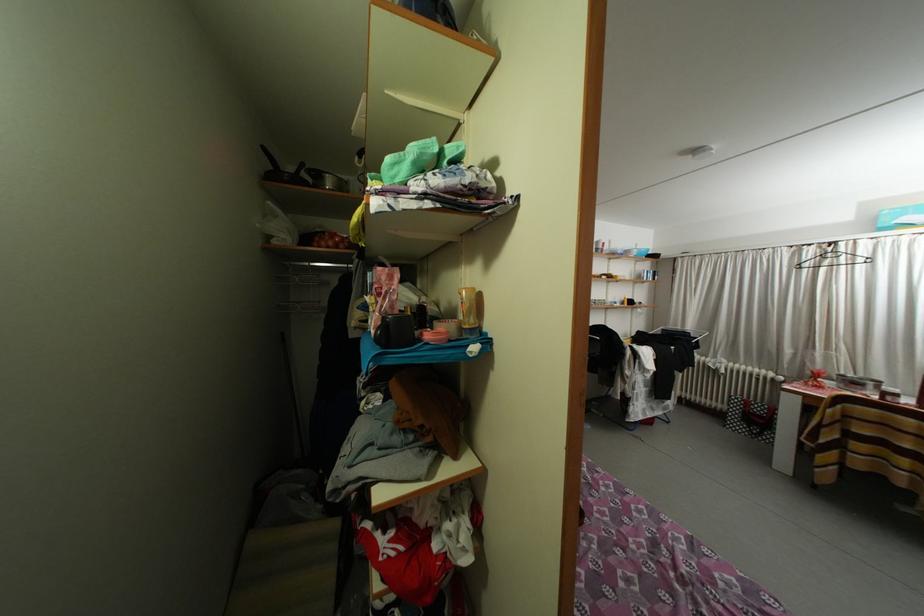
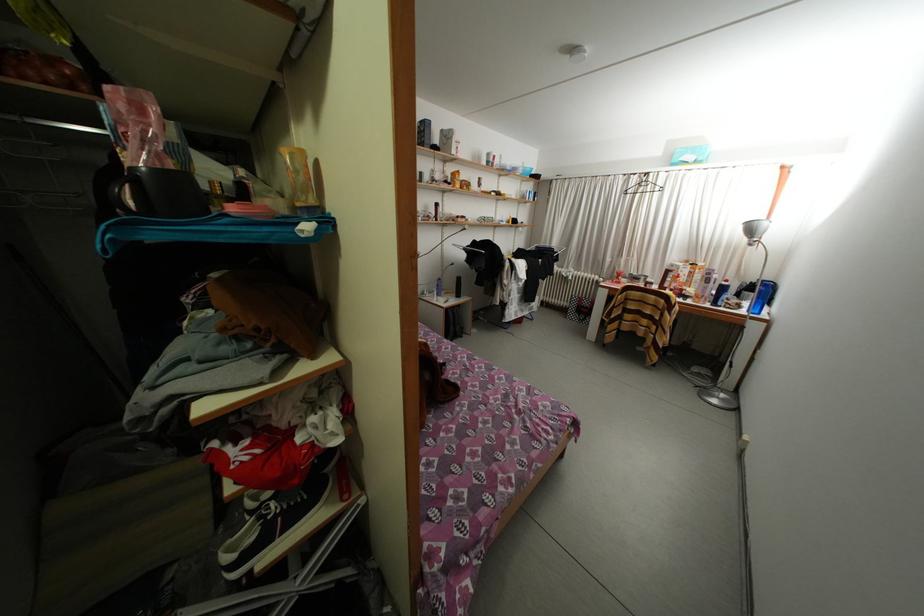
Question: In a continuous first-person perspective shot, in which direction is the camera moving?

Choices:
 (A) Left
 (B) Right
 (C) Forward
 (D) Backward

Answer: (B)